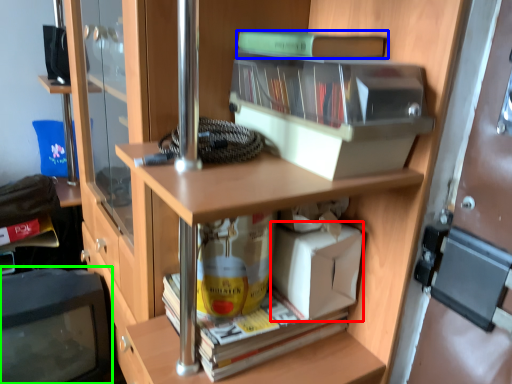
Question: Considering the real-world distances, which object is farthest from box (highlighted by a red box)? book (highlighted by a blue box) or computer monitor (highlighted by a green box)?

Choices:
 (A) book
 (B) computer monitor

Answer: (B)